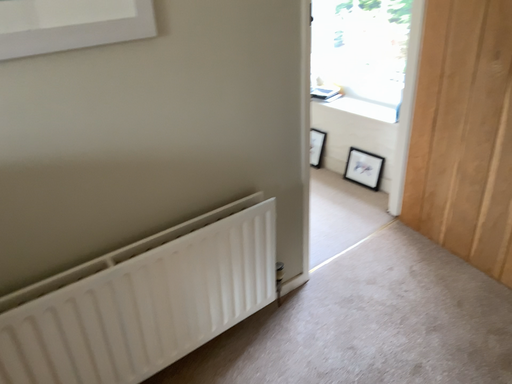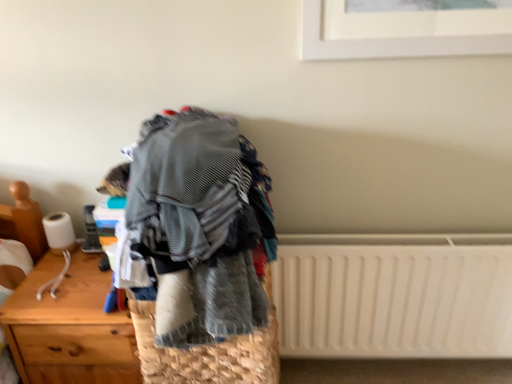
Question: How did the camera likely rotate when shooting the video?

Choices:
 (A) rotated right
 (B) rotated left

Answer: (B)